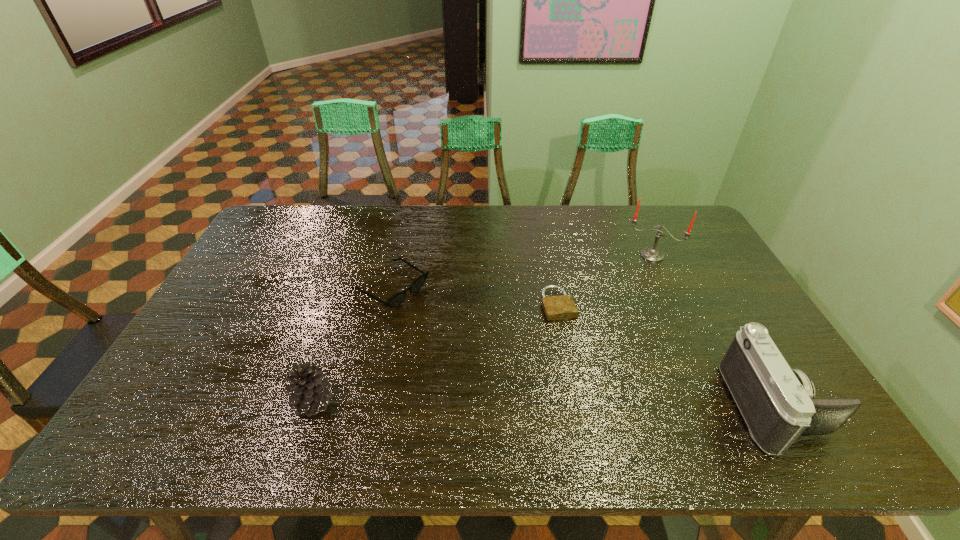
In order to click on blank region between the candle and the shortest object in this screenshot , I will do `click(605, 280)`.

I want to click on free area in between the sunglasses and the pinecone, so click(x=352, y=345).

Image resolution: width=960 pixels, height=540 pixels. I want to click on empty location between the sunglasses and the shortest object, so click(x=474, y=296).

Find the location of `empty space between the third tallest object and the padlock`. empty space between the third tallest object and the padlock is located at coordinates (436, 353).

Find the location of a particular element. The image size is (960, 540). vacant space in between the candle and the third shortest object is located at coordinates (483, 328).

Select which object is the fourth closest to the padlock. Please provide its 2D coordinates. Your answer should be formatted as a tuple, i.e. [(x, y)], where the tuple contains the x and y coordinates of a point satisfying the conditions above.

[(309, 388)]

Point out which object is positioned as the second nearest to the pinecone. Please provide its 2D coordinates. Your answer should be formatted as a tuple, i.e. [(x, y)], where the tuple contains the x and y coordinates of a point satisfying the conditions above.

[(561, 307)]

I want to click on vacant space that satisfies the following two spatial constraints: 1. on the front side of the candle; 2. at the front of the camera with an open lens cover, so click(x=724, y=406).

The image size is (960, 540). Find the location of `vacant position in the image that satisfies the following two spatial constraints: 1. on the front side of the camera; 2. at the front of the candle with an open lens cover`. vacant position in the image that satisfies the following two spatial constraints: 1. on the front side of the camera; 2. at the front of the candle with an open lens cover is located at coordinates (724, 406).

You are a GUI agent. You are given a task and a screenshot of the screen. Output one action in this format:
    pyautogui.click(x=<x>, y=<y>)
    Task: Click on the vacant point that satisfies the following two spatial constraints: 1. on the front side of the second tallest object; 2. at the front of the candle with an open lens cover
    This screenshot has height=540, width=960.
    Given the screenshot: What is the action you would take?
    pyautogui.click(x=724, y=406)